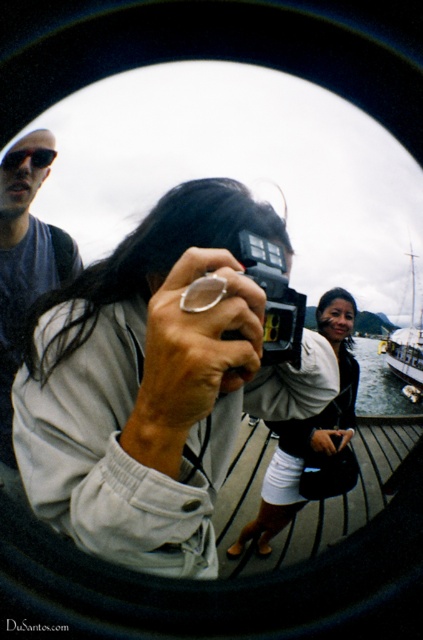
Question: Which of the following is the closest to the observer?

Choices:
 (A) matte gray shirt at upper left
 (B) matte black sunglasses at upper left
 (C) white wooden boat at right
 (D) matte white jacket at center

Answer: (A)

Question: Can you confirm if black plastic camera at center is positioned to the left of matte black sunglasses at upper left?

Choices:
 (A) no
 (B) yes

Answer: (A)

Question: Which point is closer to the camera?

Choices:
 (A) matte black sunglasses at upper left
 (B) matte gray shirt at upper left
 (C) matte white jacket at center

Answer: (B)

Question: Which point appears closest to the camera in this image?

Choices:
 (A) (387, 385)
 (B) (263, 294)
 (C) (282, 513)
 (D) (2, 170)

Answer: (B)

Question: Does matte black camera at center appear over white wooden boat at right?

Choices:
 (A) no
 (B) yes

Answer: (B)

Question: Can you confirm if black plastic camera at center is positioned above matte black sunglasses at upper left?

Choices:
 (A) yes
 (B) no

Answer: (B)